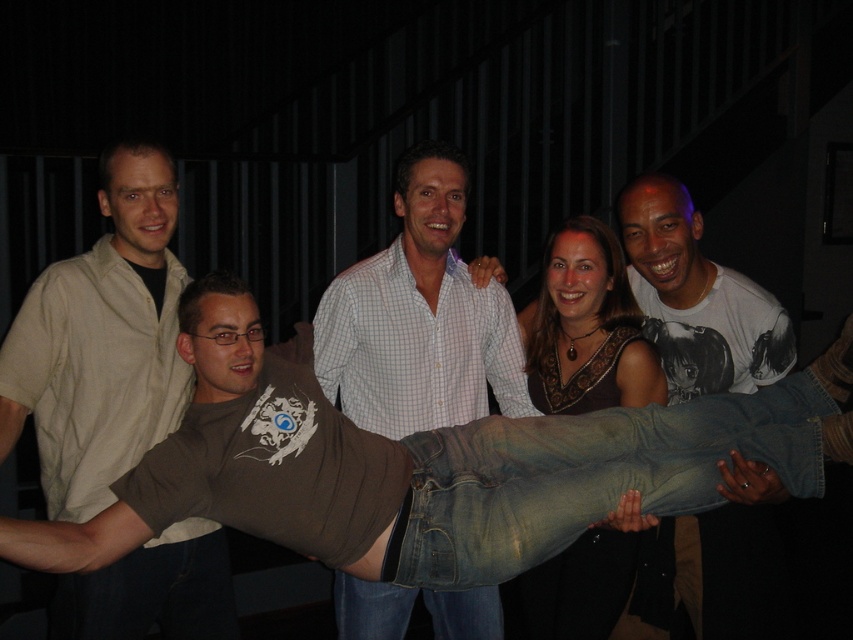
You are standing in the same room as the group. You want to hand a drink to the person wearing the jeans at center and the light beige shirt at left. Which one can you reach without moving closer?

The jeans at center is closer to the viewer than the light beige shirt at left, so you can reach the person wearing the jeans at center without moving closer.

In the scene described, there are two items of clothing visible. The jeans at center and the light beige shirt at left. Which of these two items is bigger in size?

The jeans at center is larger in size than the light beige shirt at left.